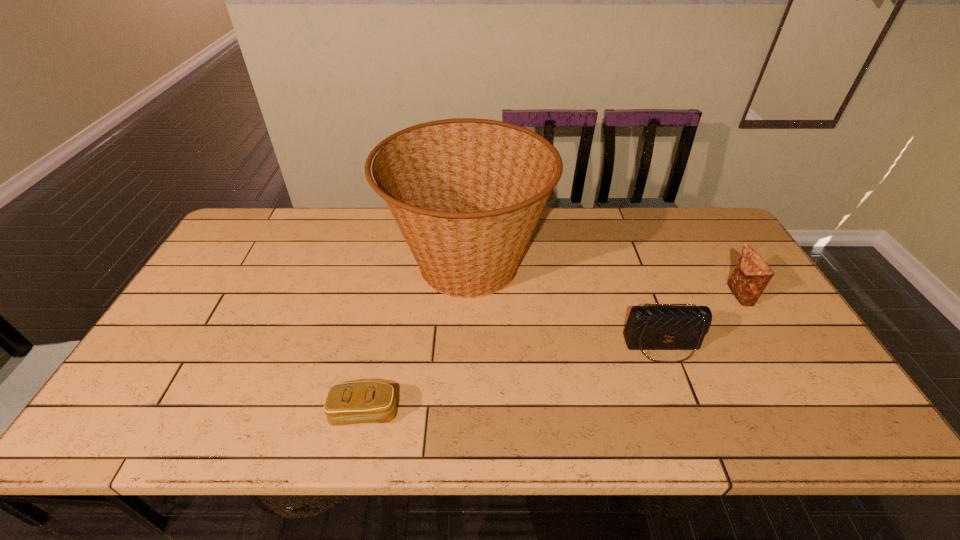
Where is `free space located on the open side of the farthest clutch bag`? Image resolution: width=960 pixels, height=540 pixels. free space located on the open side of the farthest clutch bag is located at coordinates (708, 295).

Identify the location of free location located on the front flap of the second object from right to left. click(694, 432).

The height and width of the screenshot is (540, 960). In order to click on object present at the far edge in this screenshot , I will do `click(467, 194)`.

At what (x,y) coordinates should I click in order to perform the action: click on object that is at the near edge. Please return your answer as a coordinate pair (x, y). The image size is (960, 540). Looking at the image, I should click on (364, 402).

Identify the location of object that is at the right edge. (752, 274).

In order to click on vacant space at the far edge of the desktop in this screenshot , I will do `click(636, 225)`.

In the image, there is a desktop. At what (x,y) coordinates should I click in order to perform the action: click on free space at the near edge. Please return your answer as a coordinate pair (x, y). Looking at the image, I should click on (704, 428).

You are a GUI agent. You are given a task and a screenshot of the screen. Output one action in this format:
    pyautogui.click(x=<x>, y=<y>)
    Task: Click on the free space at the left edge of the desktop
    The width and height of the screenshot is (960, 540).
    Given the screenshot: What is the action you would take?
    pyautogui.click(x=198, y=301)

In the image, there is a desktop. Where is `free space at the right edge`? This screenshot has width=960, height=540. free space at the right edge is located at coordinates tap(799, 352).

At what (x,y) coordinates should I click in order to perform the action: click on blank area at the far left corner. Please return your answer as a coordinate pair (x, y). Image resolution: width=960 pixels, height=540 pixels. Looking at the image, I should click on (260, 210).